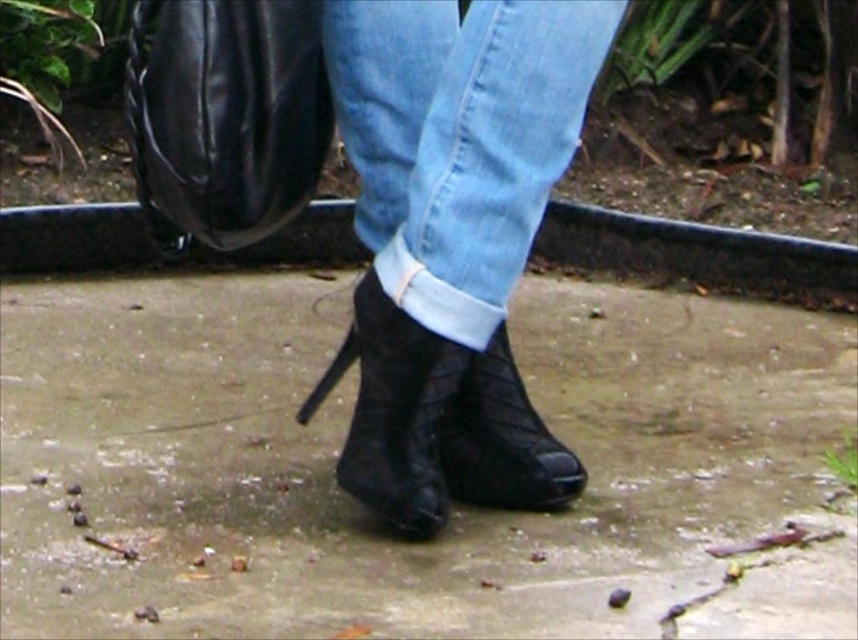
Question: Can you confirm if black leather bag at upper left is wider than black suede boot at center?

Choices:
 (A) yes
 (B) no

Answer: (B)

Question: Which of the following is the closest to the observer?

Choices:
 (A) light blue denim jeans at center
 (B) black quilted boot at center
 (C) black leather bag at upper left

Answer: (C)

Question: Does slate gray concrete at center appear under black quilted boot at center?

Choices:
 (A) yes
 (B) no

Answer: (B)

Question: Which object is farther from the camera taking this photo?

Choices:
 (A) black quilted boot at center
 (B) black leather bag at upper left

Answer: (A)

Question: Which point is closer to the camera?

Choices:
 (A) (355, 332)
 (B) (189, 144)
 (C) (421, 612)

Answer: (C)

Question: Can you confirm if light blue denim jeans at center is wider than black quilted boot at center?

Choices:
 (A) yes
 (B) no

Answer: (A)